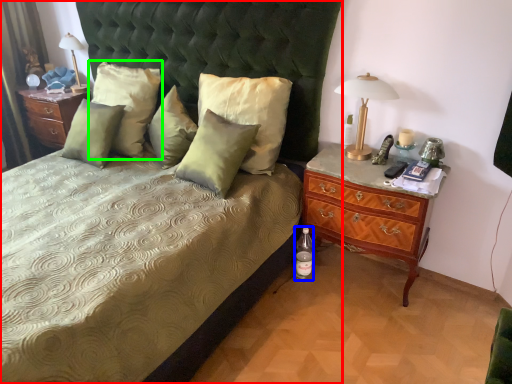
Question: Which is farther away from bed (highlighted by a red box)? bottle (highlighted by a blue box) or pillow (highlighted by a green box)?

Choices:
 (A) bottle
 (B) pillow

Answer: (A)